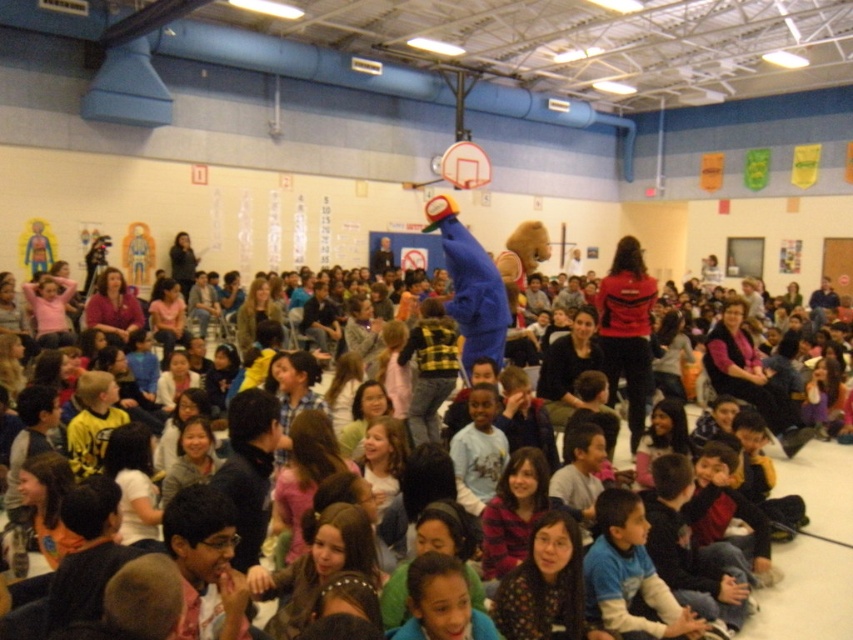
Question: Among these points, which one is nearest to the camera?

Choices:
 (A) (778, 564)
 (B) (445, 177)

Answer: (A)

Question: In this image, where is matte blue mascot at center located relative to metallic silver basketball hoop at upper center?

Choices:
 (A) right
 (B) left

Answer: (A)

Question: Which object is closer to the camera taking this photo?

Choices:
 (A) metallic silver basketball hoop at upper center
 (B) matte blue mascot at center

Answer: (B)

Question: Can you confirm if matte blue mascot at center is wider than metallic silver basketball hoop at upper center?

Choices:
 (A) no
 (B) yes

Answer: (B)

Question: Does matte blue mascot at center have a lesser width compared to metallic silver basketball hoop at upper center?

Choices:
 (A) no
 (B) yes

Answer: (A)